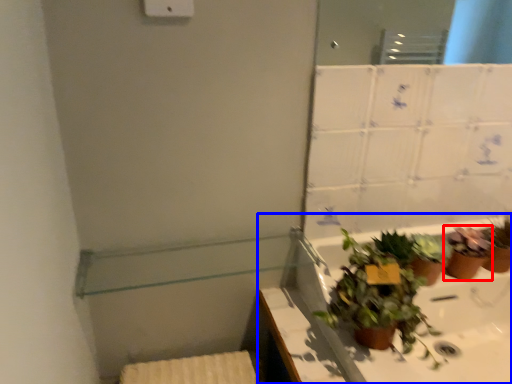
Question: Among these objects, which one is nearest to the camera, houseplant (highlighted by a red box) or bath (highlighted by a blue box)?

Choices:
 (A) houseplant
 (B) bath

Answer: (B)